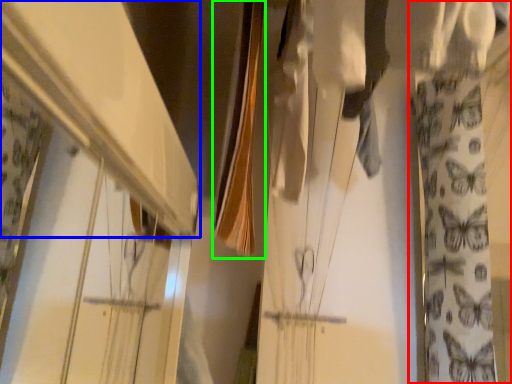
Question: Based on their relative distances, which object is nearer to curtain (highlighted by a red box)? Choose from shelf (highlighted by a blue box) and clothesline (highlighted by a green box).

Choices:
 (A) shelf
 (B) clothesline

Answer: (B)